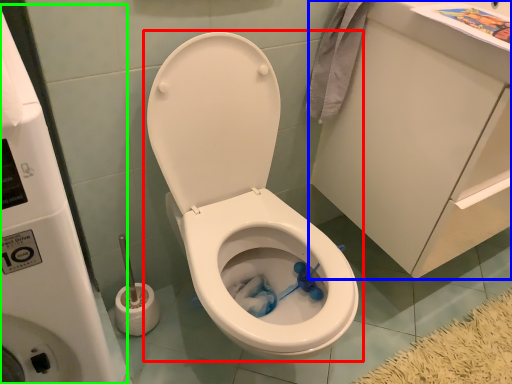
Question: Based on their relative distances, which object is farther from toilet (highlighted by a red box)? Choose from porcelain (highlighted by a blue box) and water tank (highlighted by a green box).

Choices:
 (A) porcelain
 (B) water tank

Answer: (B)